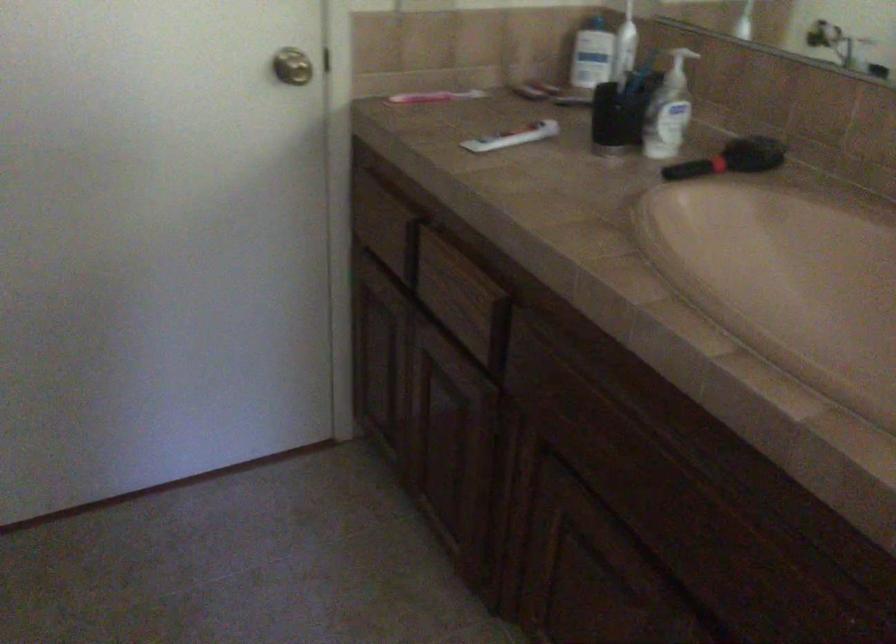
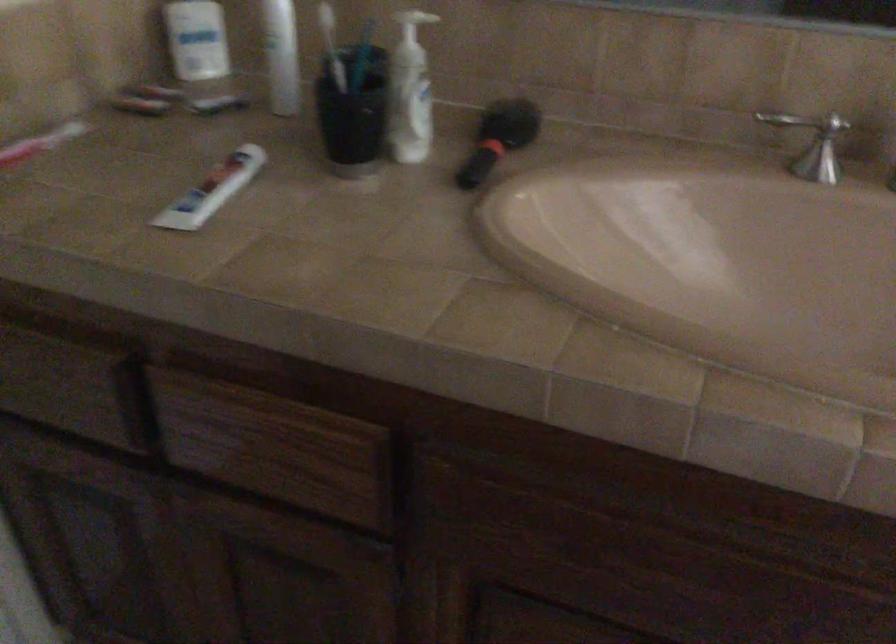
Where in the second image is the point corresponding to (728,68) from the first image?

(412, 23)